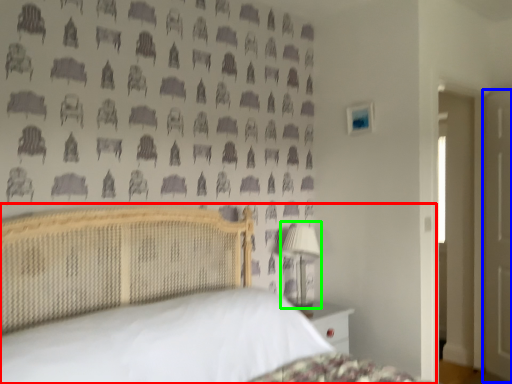
Question: Estimate the real-world distances between objects in this image. Which object is closer to bed (highlighted by a red box), door (highlighted by a blue box) or table lamp (highlighted by a green box)?

Choices:
 (A) door
 (B) table lamp

Answer: (B)